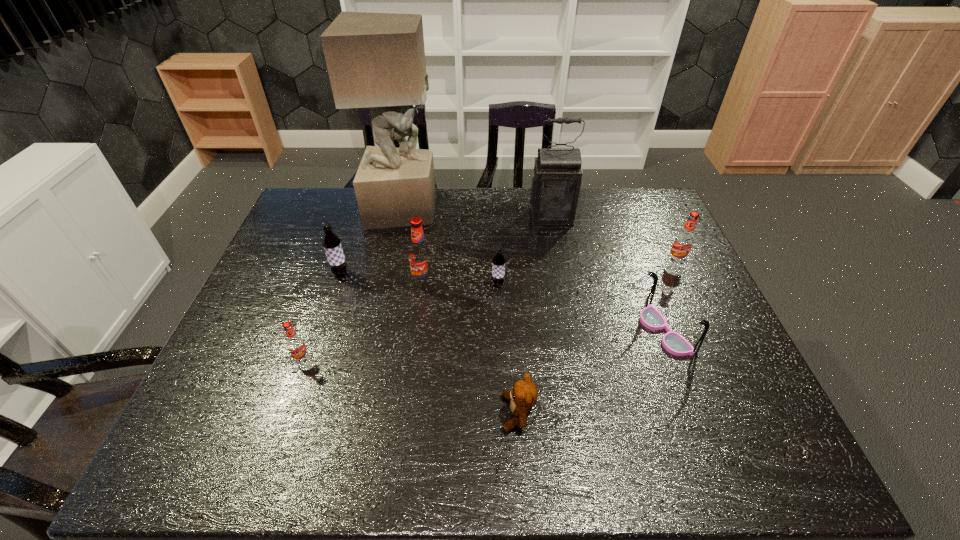
Where is `object positioned at the near edge`? This screenshot has width=960, height=540. object positioned at the near edge is located at coordinates (523, 396).

You are a GUI agent. You are given a task and a screenshot of the screen. Output one action in this format:
    pyautogui.click(x=<x>, y=<y>)
    Task: Click on the root beer present at the right edge
    
    Given the screenshot: What is the action you would take?
    pyautogui.click(x=683, y=242)

Locate an element on the screen. The width and height of the screenshot is (960, 540). spectacles that is at the right edge is located at coordinates (650, 317).

This screenshot has height=540, width=960. In order to click on vacant space at the far edge of the desktop in this screenshot , I will do `click(488, 212)`.

In the image, there is a desktop. Where is `free space at the near edge`? This screenshot has width=960, height=540. free space at the near edge is located at coordinates pyautogui.click(x=602, y=439).

In the image, there is a desktop. Where is `free space at the left edge`? The width and height of the screenshot is (960, 540). free space at the left edge is located at coordinates (314, 264).

Find the location of a particular element. The width and height of the screenshot is (960, 540). vacant area at the right edge is located at coordinates (688, 265).

Identify the location of vacant space at the far right corner of the desktop. (648, 211).

The height and width of the screenshot is (540, 960). I want to click on unoccupied position between the lantern and the smaller brown root beer, so click(x=525, y=251).

Find the location of `free space between the brown teddy bear and the gray lantern`. free space between the brown teddy bear and the gray lantern is located at coordinates (535, 315).